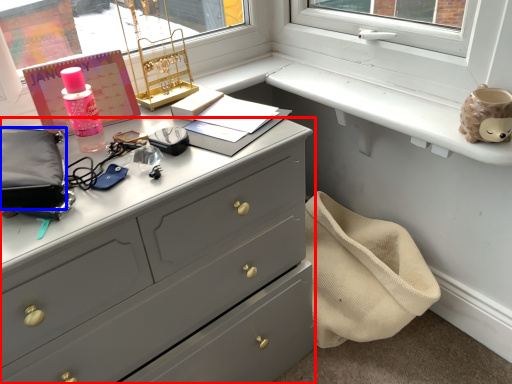
Question: Which object appears closest to the camera in this image, chest of drawers (highlighted by a red box) or pouch (highlighted by a blue box)?

Choices:
 (A) chest of drawers
 (B) pouch

Answer: (A)